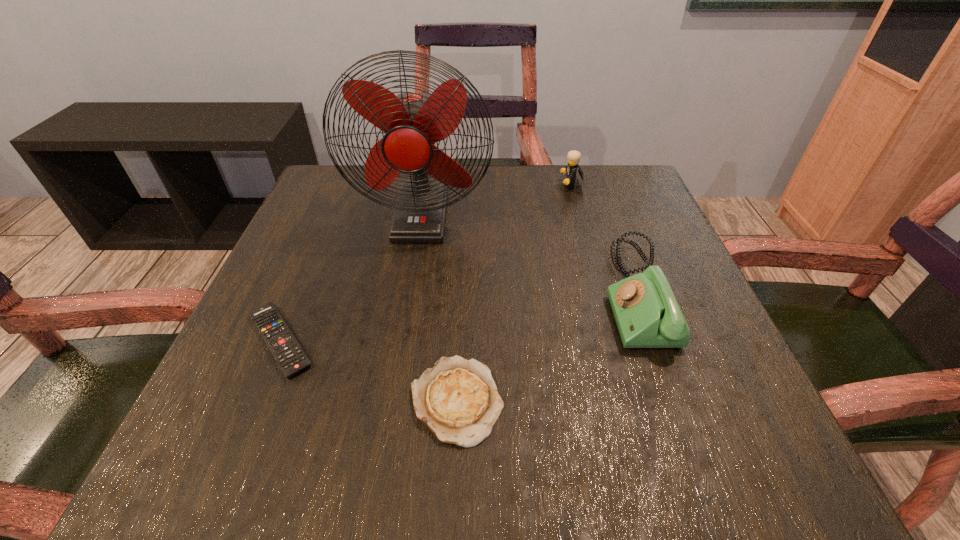
This screenshot has width=960, height=540. In order to click on fan in this screenshot , I will do `click(413, 122)`.

Identify the location of Lego. (574, 156).

The width and height of the screenshot is (960, 540). In order to click on telephone in this screenshot , I will do click(x=647, y=314).

Locate an element on the screen. The image size is (960, 540). quiche is located at coordinates (458, 400).

Locate an element on the screen. The height and width of the screenshot is (540, 960). the shortest object is located at coordinates (291, 358).

Identify the location of free space located 0.220m on the front-facing side of the fan. (402, 325).

Image resolution: width=960 pixels, height=540 pixels. I want to click on free location located on the front-facing side of the Lego, so click(x=474, y=185).

Find the location of a particular element. The width and height of the screenshot is (960, 540). vacant space located 0.170m on the front-facing side of the Lego is located at coordinates (491, 185).

Locate an element on the screen. free region located 0.090m on the front-facing side of the Lego is located at coordinates (523, 185).

Identify the location of vacant space located on the dial of the telephone. This screenshot has width=960, height=540. (391, 294).